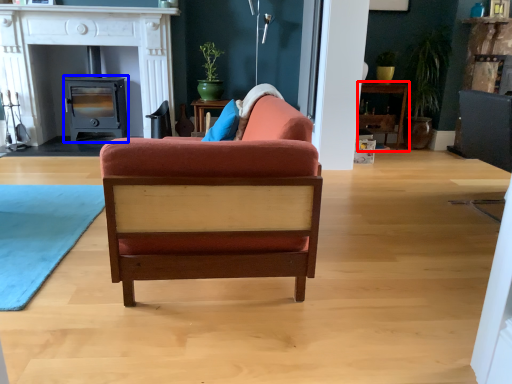
Question: Which point is further to the camera, table (highlighted by a red box) or appliance (highlighted by a blue box)?

Choices:
 (A) table
 (B) appliance

Answer: (A)